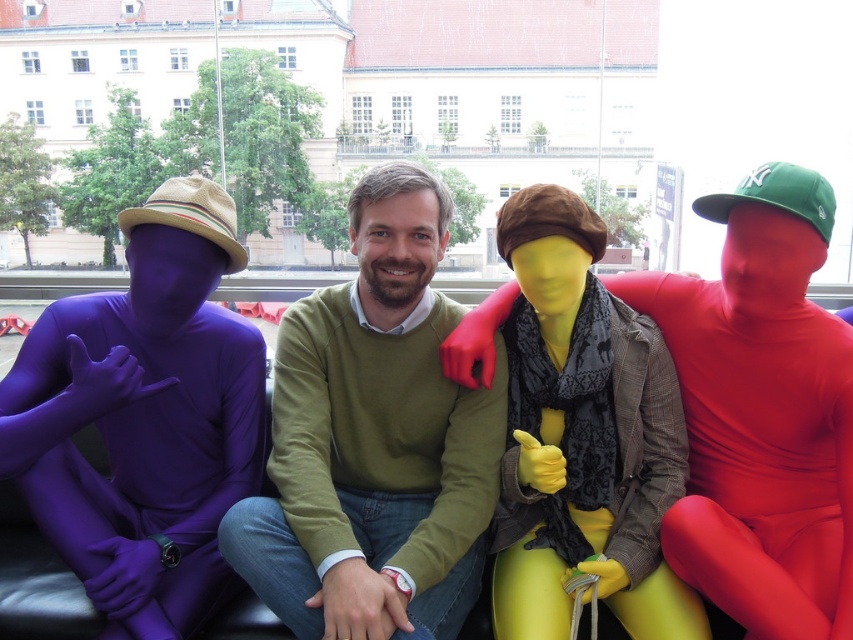
Between purple matte/skinny suit at left and matte yellow skin at center, which one is positioned higher?

purple matte/skinny suit at left is higher up.

Can you confirm if purple matte/skinny suit at left is taller than matte yellow skin at center?

Indeed, purple matte/skinny suit at left has a greater height compared to matte yellow skin at center.

The width and height of the screenshot is (853, 640). What do you see at coordinates (144, 417) in the screenshot?
I see `purple matte/skinny suit at left` at bounding box center [144, 417].

Where is `purple matte/skinny suit at left`? This screenshot has width=853, height=640. purple matte/skinny suit at left is located at coordinates (144, 417).

Between point (33, 490) and point (543, 428), which one is positioned behind?

Positioned behind is point (543, 428).

Who is more distant from viewer, [222,376] or [538,611]?

Point [222,376]

At what (x,y) coordinates should I click in order to perform the action: click on purple matte/skinny suit at left. Please return your answer as a coordinate pair (x, y). Looking at the image, I should click on (144, 417).

Is point (318, 412) positioned in front of point (74, 556)?

No, it is behind (74, 556).

Does green matte sweater at center appear on the right side of purple matte/skinny suit at left?

Yes, green matte sweater at center is to the right of purple matte/skinny suit at left.

Between point (363, 397) and point (107, 420), which one is positioned in front?

Point (107, 420) is in front.

Where is `green matte sweater at center`? green matte sweater at center is located at coordinates (374, 440).